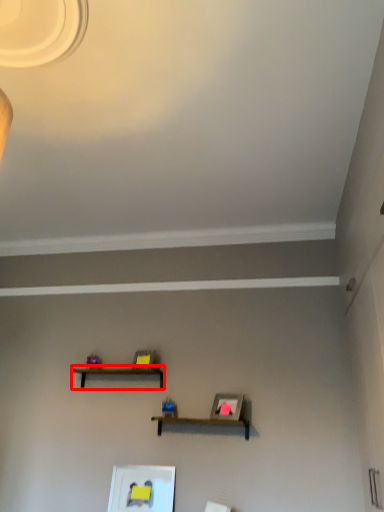
Question: From the image's perspective, considering the relative positions of shelf (annotated by the red box) and picture frame in the image provided, where is shelf (annotated by the red box) located with respect to the staircase?

Choices:
 (A) below
 (B) above

Answer: (B)